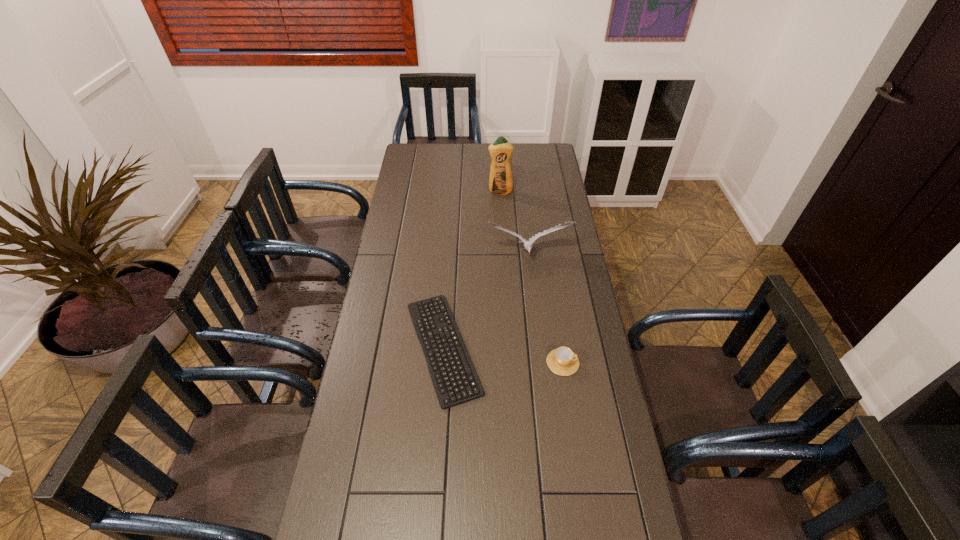
What are the coordinates of `free space located 0.240m on the front of the shortest object` in the screenshot? It's located at (433, 496).

Where is `object that is at the left edge`? The height and width of the screenshot is (540, 960). object that is at the left edge is located at coordinates (455, 380).

At what (x,y) coordinates should I click in order to perform the action: click on gull at the right edge. Please return your answer as a coordinate pair (x, y). Image resolution: width=960 pixels, height=540 pixels. Looking at the image, I should click on (527, 244).

The image size is (960, 540). I want to click on cup that is at the right edge, so click(x=562, y=361).

At what (x,y) coordinates should I click in order to perform the action: click on free space at the far edge. Please return your answer as a coordinate pair (x, y). Looking at the image, I should click on (465, 153).

Where is `free region at the left edge`? The width and height of the screenshot is (960, 540). free region at the left edge is located at coordinates (401, 214).

Find the location of a particular element. The width and height of the screenshot is (960, 540). vacant space at the right edge is located at coordinates (589, 350).

What are the coordinates of `vacant space at the far left corner` in the screenshot? It's located at pyautogui.click(x=425, y=148).

Locate an element on the screen. The width and height of the screenshot is (960, 540). vacant area that lies between the farthest object and the third shortest object is located at coordinates (514, 224).

Image resolution: width=960 pixels, height=540 pixels. Identify the location of free space that is in between the gull and the second shortest object. 544,309.